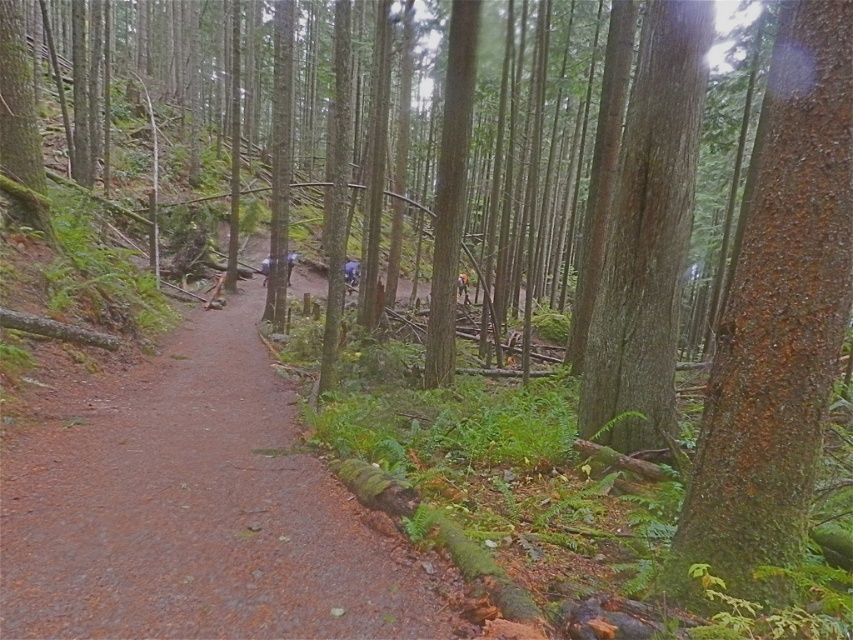
Between brown dirt path at center and smooth brown tree trunk at center-right, which one has less height?

brown dirt path at center is shorter.

Image resolution: width=853 pixels, height=640 pixels. What do you see at coordinates (195, 509) in the screenshot?
I see `brown dirt path at center` at bounding box center [195, 509].

Where is `brown dirt path at center`? The width and height of the screenshot is (853, 640). brown dirt path at center is located at coordinates (195, 509).

Is brown dirt path at center positioned behind green rough bark tree at right?

Yes.

Consider the image. Does brown dirt path at center have a greater width compared to green rough bark tree at right?

In fact, brown dirt path at center might be narrower than green rough bark tree at right.

Does point (248, 332) lie behind point (805, 68)?

Yes, point (248, 332) is farther from viewer.

The width and height of the screenshot is (853, 640). I want to click on brown dirt path at center, so click(x=195, y=509).

Measure the distance between green rough bark tree at right and smooth brown tree trunk at center-right.

1.89 meters

Who is lower down, green rough bark tree at right or smooth brown tree trunk at center-right?

Positioned lower is green rough bark tree at right.

Locate an element on the screen. Image resolution: width=853 pixels, height=640 pixels. green rough bark tree at right is located at coordinates [x=776, y=321].